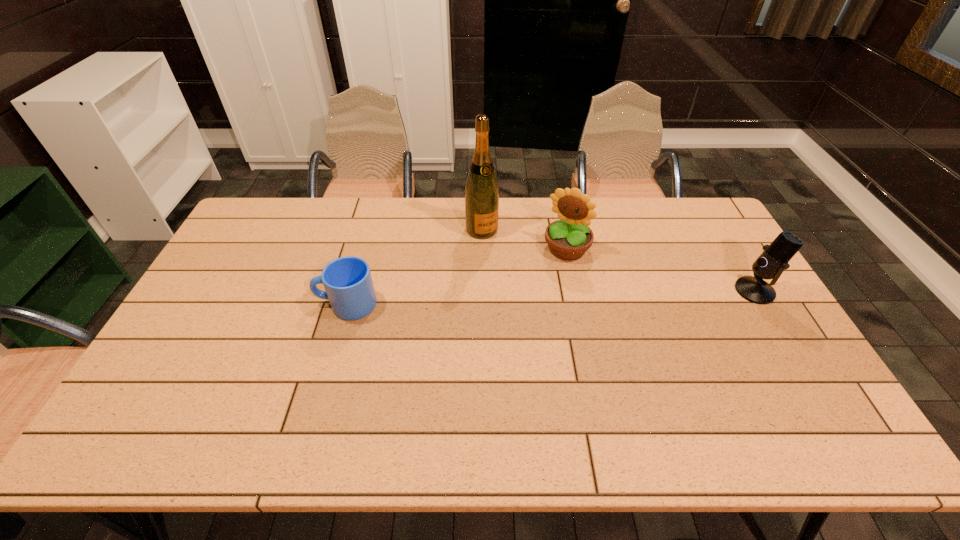
Where is `object that is at the right edge`? object that is at the right edge is located at coordinates (774, 259).

The width and height of the screenshot is (960, 540). Find the location of `vacant region at the far edge of the desktop`. vacant region at the far edge of the desktop is located at coordinates (329, 206).

Locate an element on the screen. This screenshot has width=960, height=540. vacant space at the near edge of the desktop is located at coordinates (599, 390).

This screenshot has height=540, width=960. I want to click on vacant space at the left edge of the desktop, so click(264, 266).

Locate an element on the screen. This screenshot has height=540, width=960. vacant space at the right edge is located at coordinates (784, 363).

In the image, there is a desktop. Where is `vacant space at the far right corner`? The width and height of the screenshot is (960, 540). vacant space at the far right corner is located at coordinates (708, 210).

You are a GUI agent. You are given a task and a screenshot of the screen. Output one action in this format:
    pyautogui.click(x=<x>, y=<y>)
    Task: Click on the vacant space that is in between the second object from right to left and the wine bottle
    This screenshot has height=540, width=960.
    Given the screenshot: What is the action you would take?
    pyautogui.click(x=524, y=239)

Image resolution: width=960 pixels, height=540 pixels. In order to click on free space that is in between the sunflower and the rightmost object in this screenshot , I will do `click(660, 270)`.

Image resolution: width=960 pixels, height=540 pixels. What are the coordinates of `vacant space that is in between the third object from right to left and the microphone` in the screenshot? It's located at (618, 260).

The height and width of the screenshot is (540, 960). In order to click on vacant space that's between the wine bottle and the third object from left to right in this screenshot , I will do `click(524, 239)`.